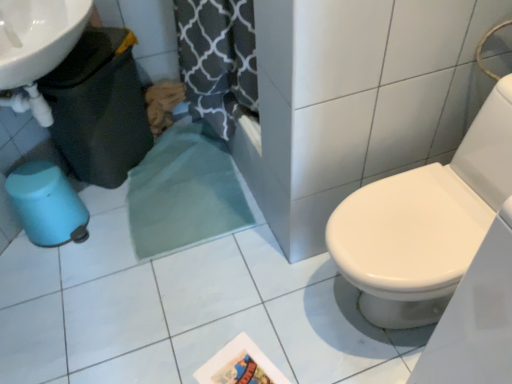
Question: Is matte plastic potty at lower left, which is the 1th potty from bottom to top, shorter than matte black trash can at left, arranged as the 2th potty when ordered from the bottom?

Choices:
 (A) yes
 (B) no

Answer: (A)

Question: Is matte plastic potty at lower left, placed as the 2th potty when sorted from top to bottom, to the left of matte black trash can at left, marked as the 1th potty in a top-to-bottom arrangement, from the viewer's perspective?

Choices:
 (A) no
 (B) yes

Answer: (B)

Question: Is matte plastic potty at lower left, which is the 1th potty from bottom to top, taller than matte black trash can at left, arranged as the 2th potty when ordered from the bottom?

Choices:
 (A) yes
 (B) no

Answer: (B)

Question: From the image's perspective, is matte plastic potty at lower left, placed as the 2th potty when sorted from top to bottom, located above matte black trash can at left, marked as the 1th potty in a top-to-bottom arrangement?

Choices:
 (A) yes
 (B) no

Answer: (B)

Question: From a real-world perspective, does matte plastic potty at lower left, which is the 1th potty from bottom to top, sit lower than matte black trash can at left, arranged as the 2th potty when ordered from the bottom?

Choices:
 (A) no
 (B) yes

Answer: (B)

Question: Considering the relative positions of matte plastic potty at lower left, placed as the 2th potty when sorted from top to bottom, and matte black trash can at left, marked as the 1th potty in a top-to-bottom arrangement, in the image provided, is matte plastic potty at lower left, placed as the 2th potty when sorted from top to bottom, behind matte black trash can at left, marked as the 1th potty in a top-to-bottom arrangement,?

Choices:
 (A) yes
 (B) no

Answer: (A)

Question: Considering the relative positions of matte black trash can at left, marked as the 1th potty in a top-to-bottom arrangement, and matte plastic potty at lower left, which is the 1th potty from bottom to top, in the image provided, is matte black trash can at left, marked as the 1th potty in a top-to-bottom arrangement, to the right of matte plastic potty at lower left, which is the 1th potty from bottom to top, from the viewer's perspective?

Choices:
 (A) no
 (B) yes

Answer: (B)

Question: Are matte black trash can at left, arranged as the 2th potty when ordered from the bottom, and matte plastic potty at lower left, placed as the 2th potty when sorted from top to bottom, making contact?

Choices:
 (A) no
 (B) yes

Answer: (A)

Question: From the image's perspective, is matte black trash can at left, marked as the 1th potty in a top-to-bottom arrangement, located above matte plastic potty at lower left, which is the 1th potty from bottom to top?

Choices:
 (A) yes
 (B) no

Answer: (A)

Question: Is matte black trash can at left, marked as the 1th potty in a top-to-bottom arrangement, not close to matte plastic potty at lower left, placed as the 2th potty when sorted from top to bottom?

Choices:
 (A) no
 (B) yes

Answer: (A)

Question: Considering the relative sizes of matte black trash can at left, arranged as the 2th potty when ordered from the bottom, and matte plastic potty at lower left, placed as the 2th potty when sorted from top to bottom, in the image provided, is matte black trash can at left, arranged as the 2th potty when ordered from the bottom, thinner than matte plastic potty at lower left, placed as the 2th potty when sorted from top to bottom,?

Choices:
 (A) yes
 (B) no

Answer: (A)

Question: Does matte black trash can at left, marked as the 1th potty in a top-to-bottom arrangement, have a greater width compared to matte plastic potty at lower left, which is the 1th potty from bottom to top?

Choices:
 (A) no
 (B) yes

Answer: (A)

Question: In terms of height, does matte black trash can at left, marked as the 1th potty in a top-to-bottom arrangement, look taller or shorter compared to matte plastic potty at lower left, which is the 1th potty from bottom to top?

Choices:
 (A) short
 (B) tall

Answer: (B)